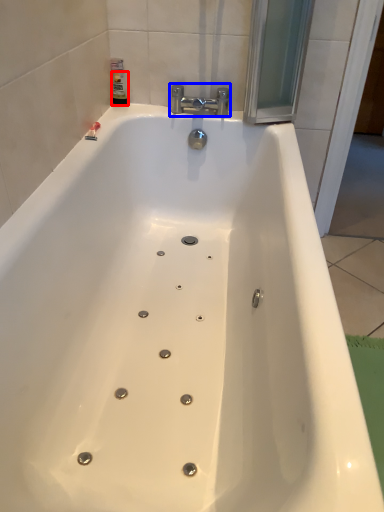
Question: Which object is closer to the camera taking this photo, toiletry (highlighted by a red box) or tap (highlighted by a blue box)?

Choices:
 (A) toiletry
 (B) tap

Answer: (B)